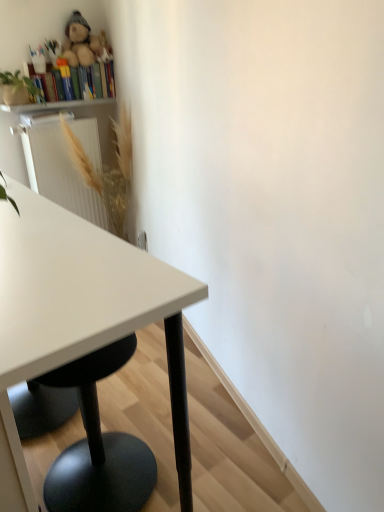
Question: Relative to white glossy table at left, is golden textured plant at upper left in front or behind?

Choices:
 (A) front
 (B) behind

Answer: (B)

Question: Considering the positions of point 112,121 and point 82,300, is point 112,121 closer or farther from the camera than point 82,300?

Choices:
 (A) closer
 (B) farther

Answer: (B)

Question: Which is nearer to the golden textured plant at upper left?

Choices:
 (A) fluffy plush bear at upper left
 (B) wooden bookshelf at upper left
 (C) white glossy table at left
 (D) green matte plant at upper left
 (E) multicolored cardboard books at upper left

Answer: (B)

Question: Which of these objects is positioned closest to the wooden bookshelf at upper left?

Choices:
 (A) fluffy plush bear at upper left
 (B) golden textured plant at upper left
 (C) green matte plant at upper left
 (D) multicolored cardboard books at upper left
 (E) white glossy table at left

Answer: (D)